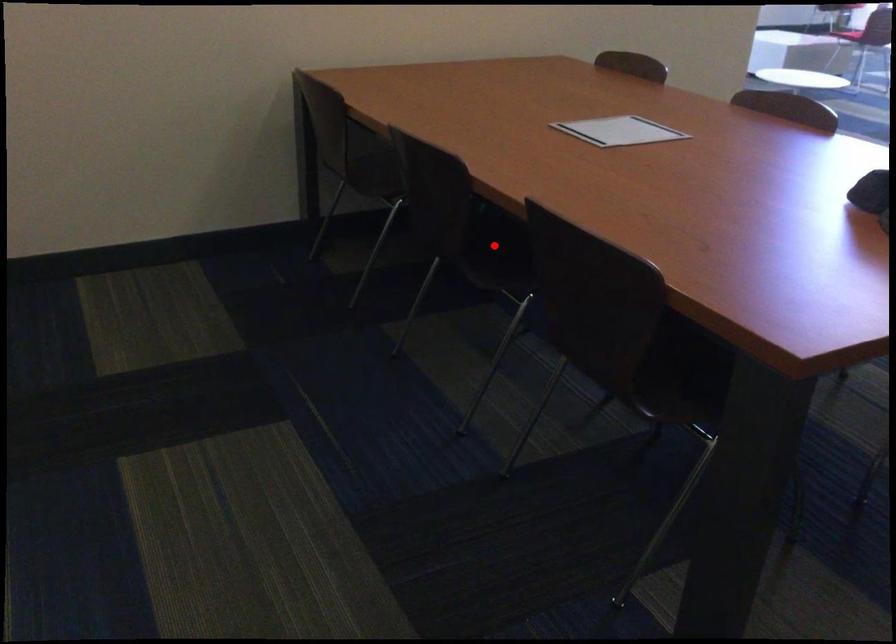
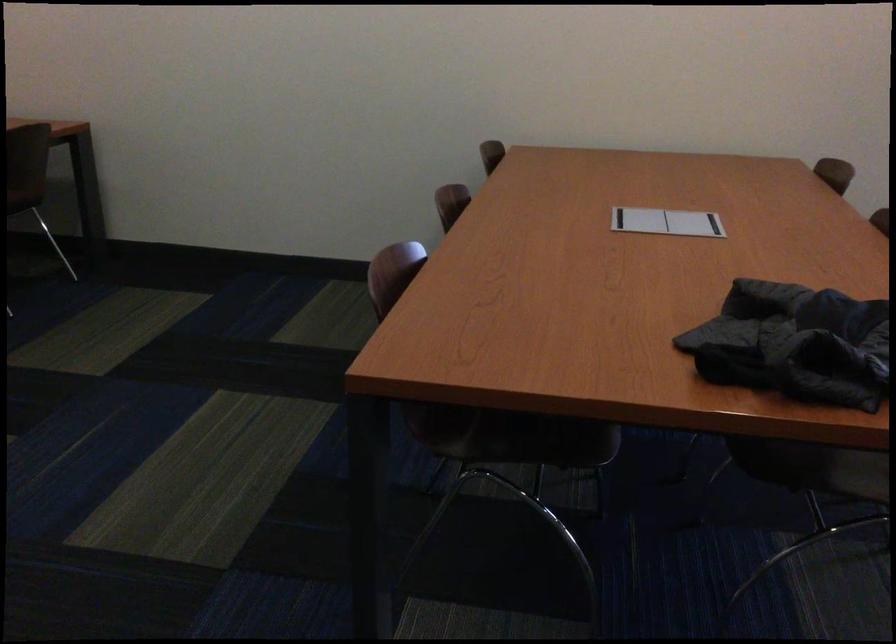
Question: I am providing you with two images of the same scene from different viewpoints. A red point is marked on the first image. At the location where the point appears in image 1, is it still visible in image 2?

Choices:
 (A) Yes
 (B) No

Answer: (B)